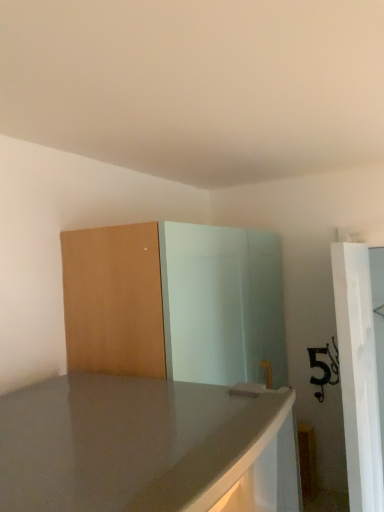
Question: Is matte wood dresser at center placed right next to white glossy screen door at right?

Choices:
 (A) yes
 (B) no

Answer: (B)

Question: Is matte wood dresser at center facing towards white glossy screen door at right?

Choices:
 (A) no
 (B) yes

Answer: (B)

Question: From the image's perspective, is matte wood dresser at center located beneath white glossy screen door at right?

Choices:
 (A) yes
 (B) no

Answer: (B)

Question: From the image's perspective, would you say matte wood dresser at center is positioned over white glossy screen door at right?

Choices:
 (A) no
 (B) yes

Answer: (B)

Question: Is matte wood dresser at center at the right side of white glossy screen door at right?

Choices:
 (A) no
 (B) yes

Answer: (A)

Question: Is matte wood dresser at center to the left of white glossy screen door at right from the viewer's perspective?

Choices:
 (A) yes
 (B) no

Answer: (A)

Question: Does white glossy screen door at right have a greater width compared to matte wood dresser at center?

Choices:
 (A) no
 (B) yes

Answer: (A)

Question: Is white glossy screen door at right taller than matte wood dresser at center?

Choices:
 (A) yes
 (B) no

Answer: (A)

Question: From a real-world perspective, does white glossy screen door at right stand above matte wood dresser at center?

Choices:
 (A) yes
 (B) no

Answer: (B)

Question: Is white glossy screen door at right shorter than matte wood dresser at center?

Choices:
 (A) yes
 (B) no

Answer: (B)

Question: Does white glossy screen door at right come behind matte wood dresser at center?

Choices:
 (A) yes
 (B) no

Answer: (A)

Question: Is the position of white glossy screen door at right less distant than that of matte wood dresser at center?

Choices:
 (A) no
 (B) yes

Answer: (A)

Question: From the image's perspective, is matte wood dresser at center positioned above or below white glossy screen door at right?

Choices:
 (A) above
 (B) below

Answer: (A)